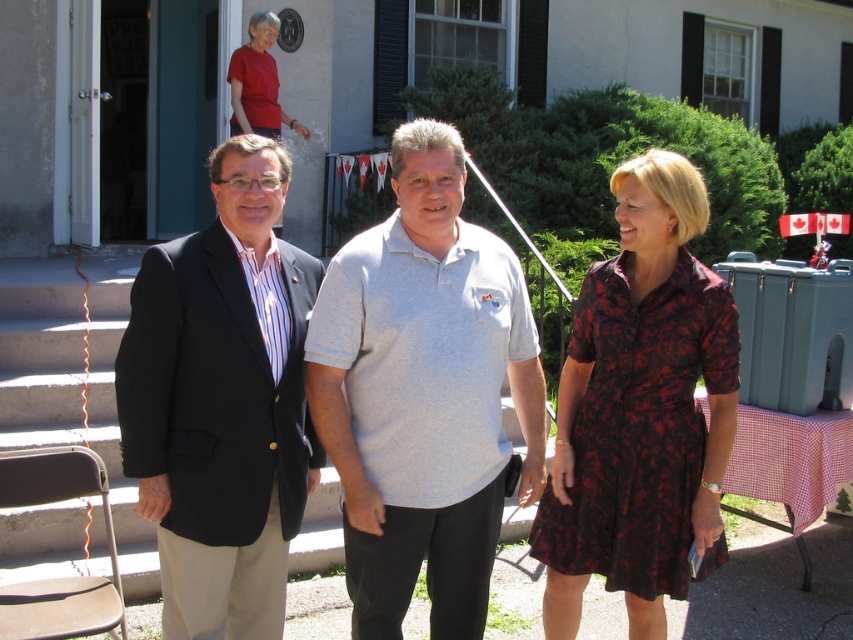
You are a photographer trying to capture a photo of the matte black blazer at center and the matte red shirt at upper center. Which object should you focus on first if you want to ensure both are in sharp focus?

The matte black blazer at center is positioned under the matte red shirt at upper center, so focusing on the matte red shirt at upper center first will help ensure both are in focus since it is closer to the camera.

You are standing at the origin point in the image and want to walk towards the point at coordinates point (425, 186) and point (303, 136). Which point will you reach first?

You will reach point (425, 186) first because it is closer to you than point (303, 136), which is further away.